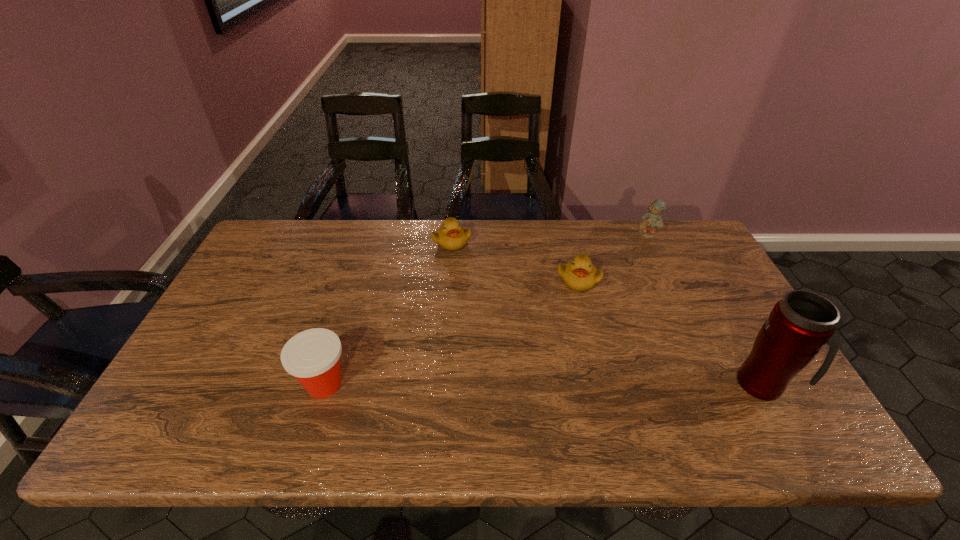
Image resolution: width=960 pixels, height=540 pixels. What are the coordinates of `free space located on the front-facing side of the right duckling` in the screenshot? It's located at pyautogui.click(x=584, y=333).

The height and width of the screenshot is (540, 960). I want to click on free space located on the front-facing side of the right duckling, so click(x=586, y=348).

Where is `vacant space situated 0.390m at the beak of the left duckling`? The width and height of the screenshot is (960, 540). vacant space situated 0.390m at the beak of the left duckling is located at coordinates (472, 346).

Where is `vacant space situated 0.390m at the beak of the left duckling`? This screenshot has width=960, height=540. vacant space situated 0.390m at the beak of the left duckling is located at coordinates (472, 346).

At what (x,y) coordinates should I click in order to perform the action: click on free space located at the beak of the left duckling. Please return your answer as a coordinate pair (x, y). The width and height of the screenshot is (960, 540). Looking at the image, I should click on 466,310.

The height and width of the screenshot is (540, 960). I want to click on vacant space located 0.350m on the front-facing side of the second object from right to left, so click(616, 304).

Find the location of a particular element. The height and width of the screenshot is (540, 960). free space located on the front-facing side of the second object from right to left is located at coordinates (613, 311).

I want to click on free space located 0.370m on the front-facing side of the second object from right to left, so click(614, 309).

Identify the location of duckling present at the far edge. pyautogui.click(x=450, y=236).

The height and width of the screenshot is (540, 960). Identify the location of teddy bear at the far edge. (651, 220).